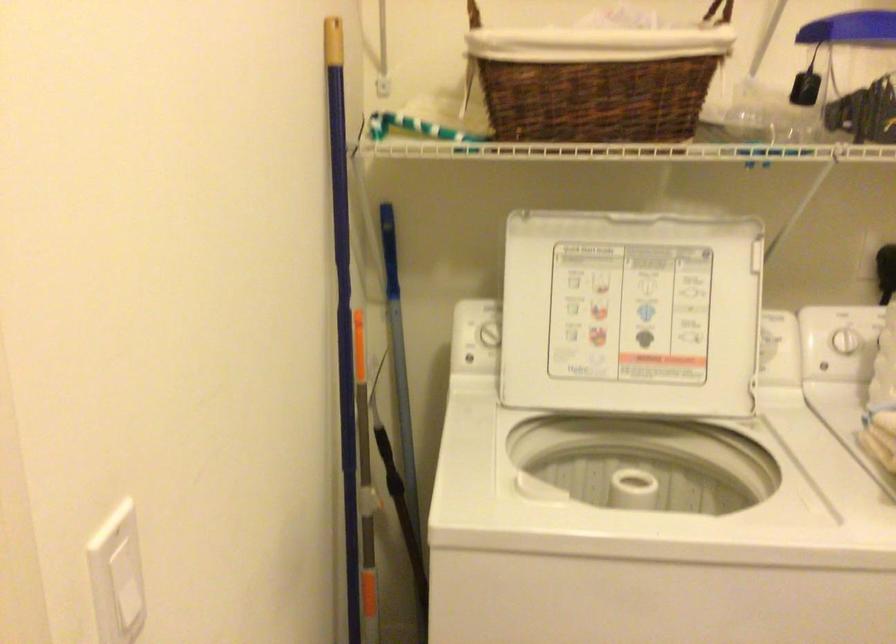
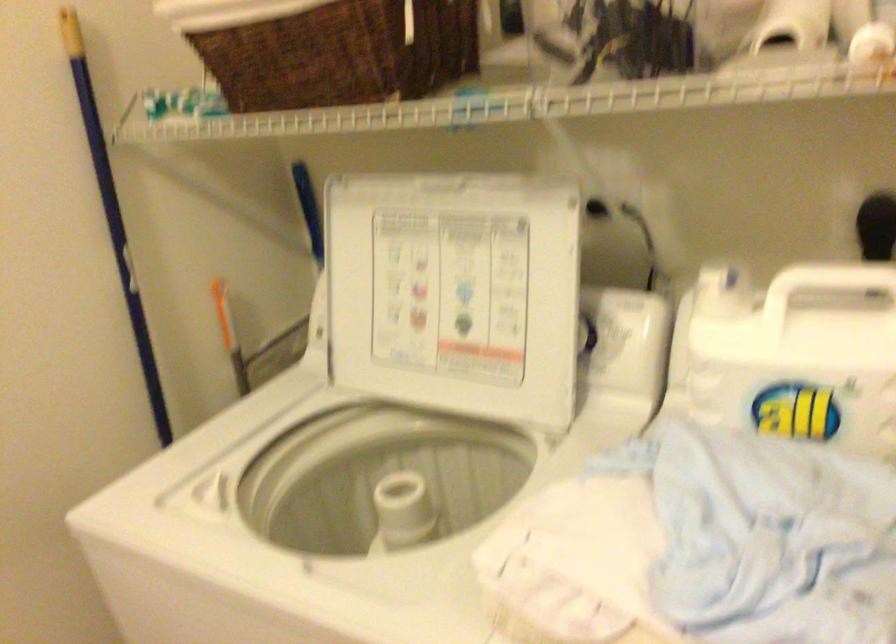
In the second image, find the point that corresponds to pixel 346 234 in the first image.

(113, 216)